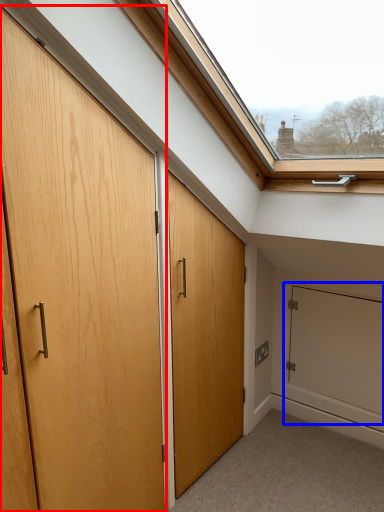
Question: Which object appears closest to the camera in this image, door (highlighted by a red box) or screen door (highlighted by a blue box)?

Choices:
 (A) door
 (B) screen door

Answer: (A)